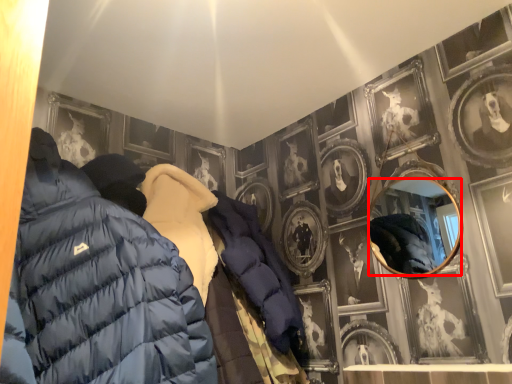
Question: In this image, where is mirror (annotated by the red box) located relative to jacket?

Choices:
 (A) left
 (B) right

Answer: (B)